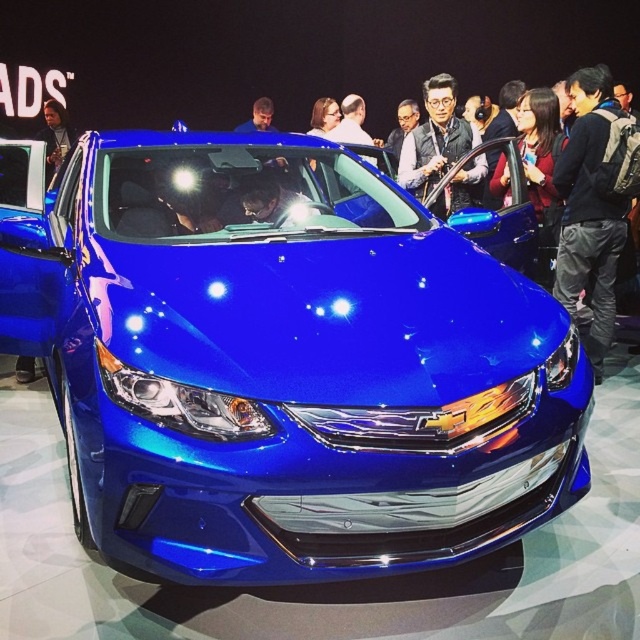
Question: Is black backpack at right in front of matte black jacket at upper left?

Choices:
 (A) yes
 (B) no

Answer: (A)

Question: Which object is the closest to the matte black vest at center?

Choices:
 (A) black backpack at right
 (B) matte black jacket at upper left
 (C) glossy metallic car at center

Answer: (A)

Question: Does glossy metallic car at center have a greater width compared to matte black vest at center?

Choices:
 (A) no
 (B) yes

Answer: (B)

Question: Does black backpack at right lie in front of matte black jacket at upper left?

Choices:
 (A) no
 (B) yes

Answer: (B)

Question: Which point appears farthest from the camera in this image?

Choices:
 (A) (48, 177)
 (B) (436, 154)

Answer: (B)

Question: Among these points, which one is nearest to the camera?

Choices:
 (A) (380, 438)
 (B) (467, 164)
 (C) (596, 332)

Answer: (A)